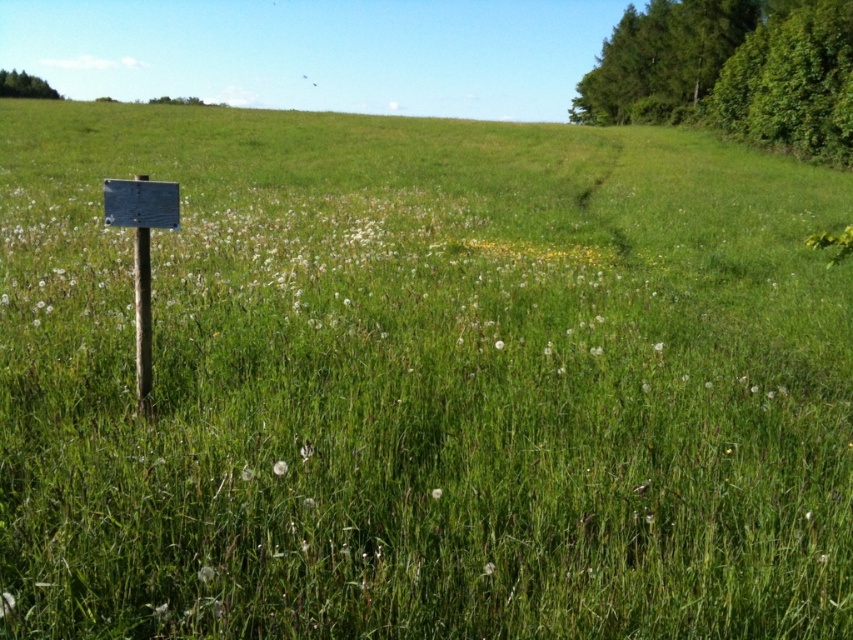
You are a hiker who wants to locate the green leafy tree at upper left. From the metallic signpost at left, which direction should you walk to reach it?

The metallic signpost at left is to the right of the green leafy tree at upper left, so you should walk to the left to reach the green leafy tree at upper left.

You are standing in the middle of the field and want to walk towards the green leafy tree at upper right and the green leafy tree at upper left. Which tree will you reach first?

The green leafy tree at upper right is closer to the viewer than the green leafy tree at upper left, so you will reach the green leafy tree at upper right first.